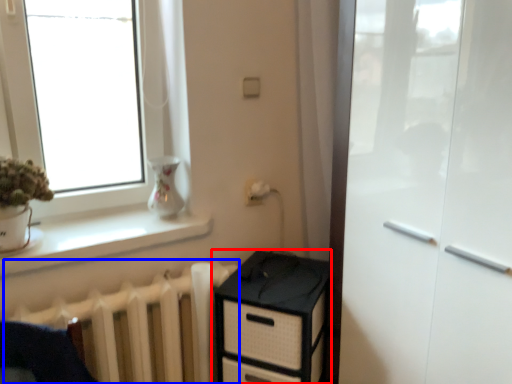
Question: Which point is further to the camera, chest of drawers (highlighted by a red box) or radiator (highlighted by a blue box)?

Choices:
 (A) chest of drawers
 (B) radiator

Answer: (A)